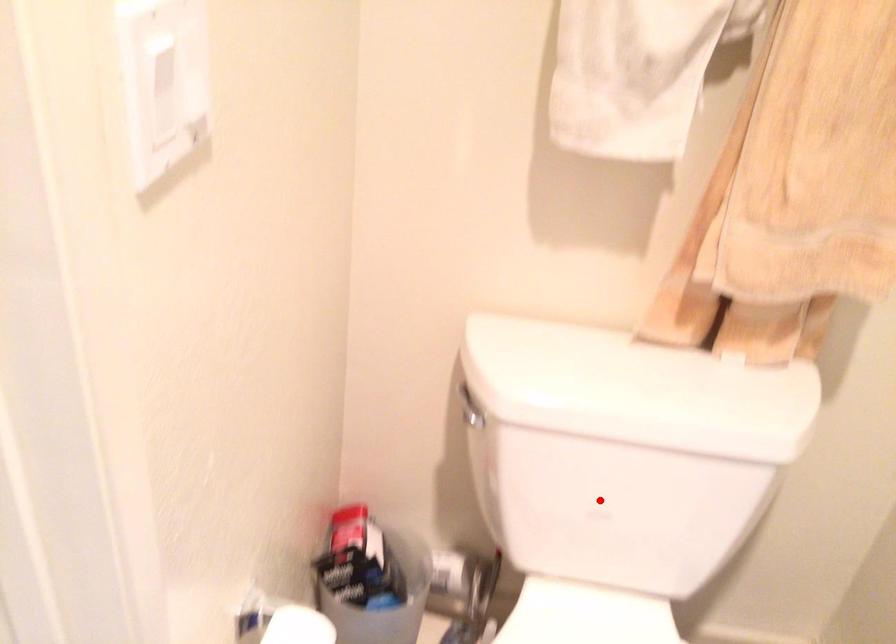
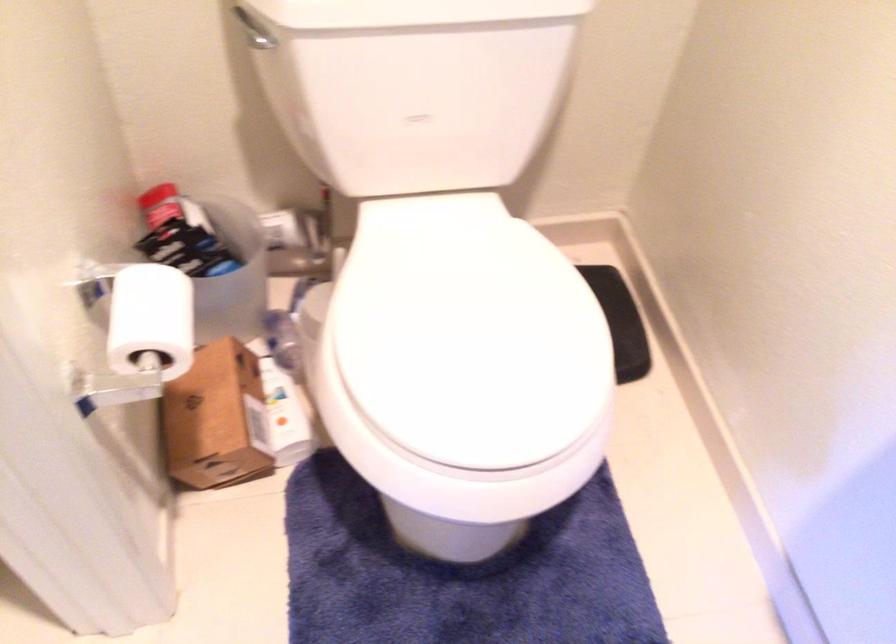
Where in the second image is the point corresponding to the highlighted location from the first image?

(418, 104)